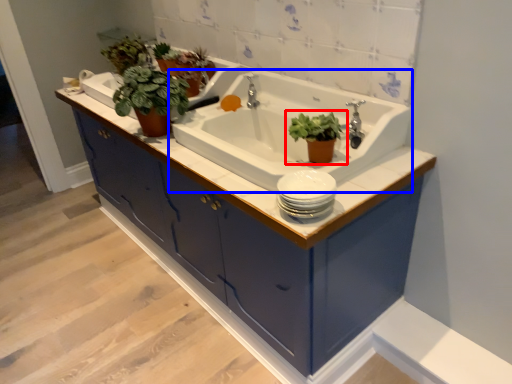
Question: Which of the following is the closest to the observer, houseplant (highlighted by a red box) or sink (highlighted by a blue box)?

Choices:
 (A) houseplant
 (B) sink

Answer: (B)